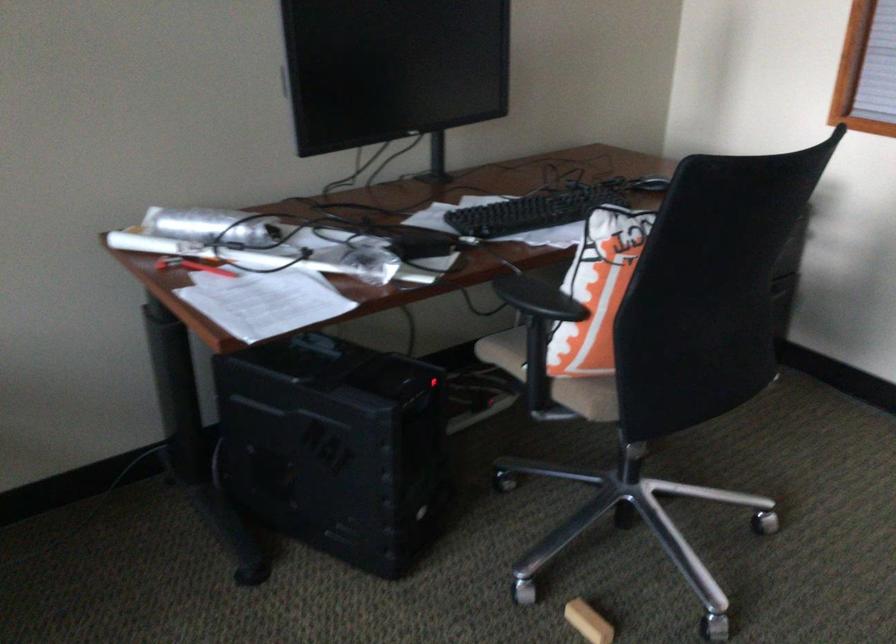
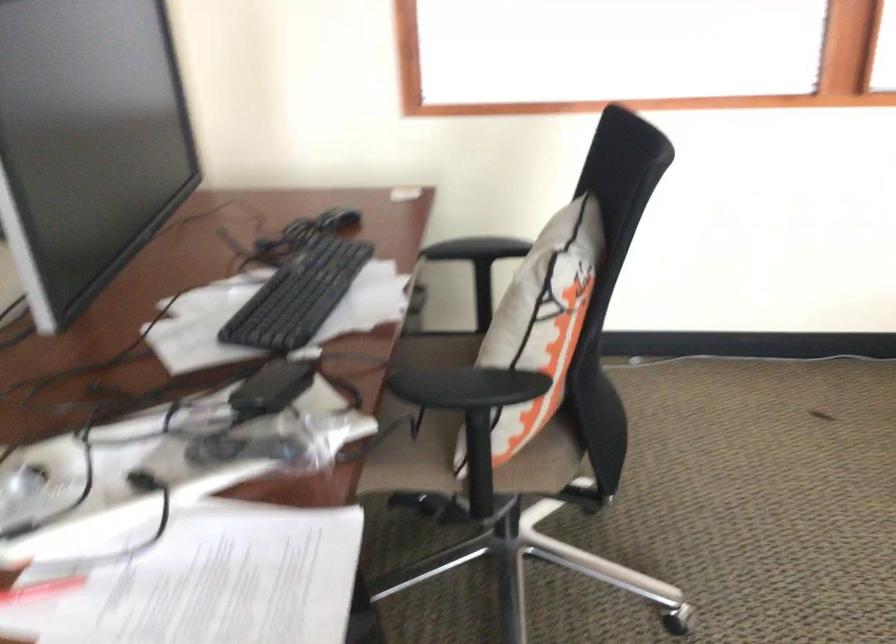
Question: The camera is either moving clockwise (left) or counter-clockwise (right) around the object. The first image is from the beginning of the video and the second image is from the end. Is the camera moving left or right when shooting the video?

Choices:
 (A) Left
 (B) Right

Answer: (A)